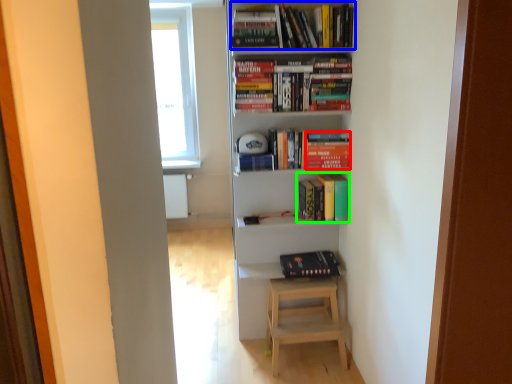
Question: Which object is the closest to the paperback book (highlighted by a red box)? Choose among these: book (highlighted by a blue box) or book (highlighted by a green box).

Choices:
 (A) book
 (B) book

Answer: (B)